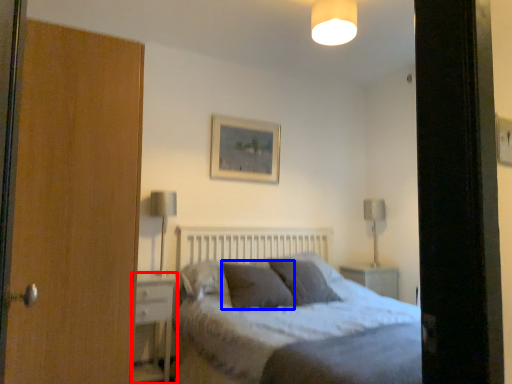
Question: Which object appears farthest to the camera in this image, nightstand (highlighted by a red box) or pillow (highlighted by a blue box)?

Choices:
 (A) nightstand
 (B) pillow

Answer: (B)